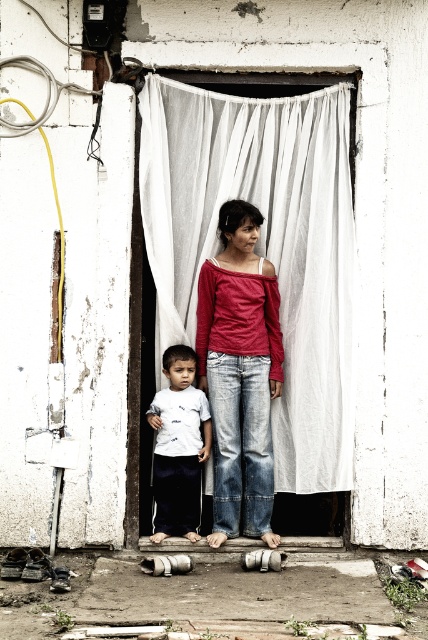
Question: Is matte red shirt at center thinner than white matte shirt at center?

Choices:
 (A) no
 (B) yes

Answer: (A)

Question: Can you confirm if white sheer curtain at center is positioned above matte red shirt at center?

Choices:
 (A) no
 (B) yes

Answer: (B)

Question: Among these points, which one is nearest to the camera?

Choices:
 (A) (252, 420)
 (B) (205, 444)

Answer: (A)

Question: Which point is farther to the camera?

Choices:
 (A) white sheer curtain at center
 (B) matte red shirt at center
 (C) white matte shirt at center

Answer: (C)

Question: Which point is closer to the camera?

Choices:
 (A) matte red shirt at center
 (B) white sheer curtain at center

Answer: (A)

Question: Does matte red shirt at center have a lesser width compared to white matte shirt at center?

Choices:
 (A) yes
 (B) no

Answer: (B)